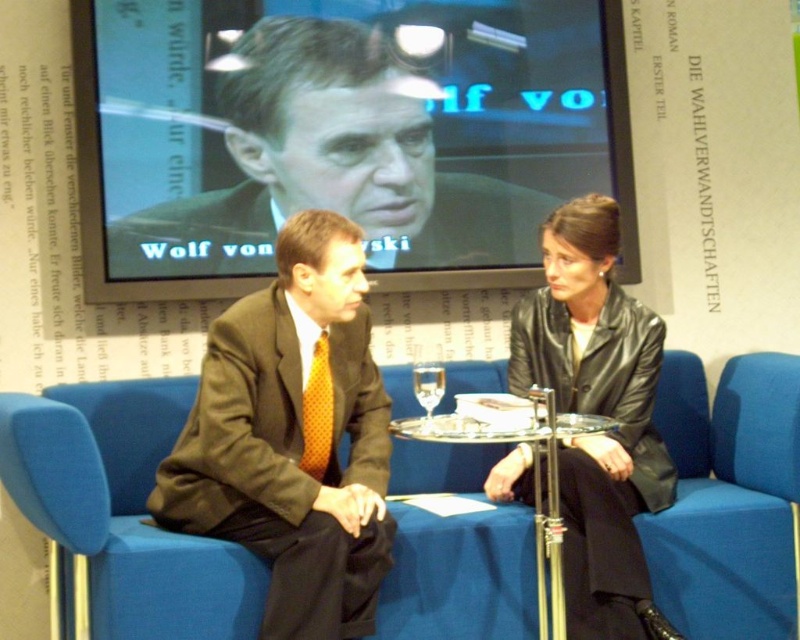
Question: From the image, what is the correct spatial relationship of blue fabric chair at center in relation to clear glass table at center?

Choices:
 (A) left
 (B) right

Answer: (B)

Question: Observing the image, what is the correct spatial positioning of matte black suit at upper center in reference to blue fabric chair at lower right?

Choices:
 (A) left
 (B) right

Answer: (A)

Question: Can you confirm if orange dotted tie at center is positioned below transparent glass at table center?

Choices:
 (A) no
 (B) yes

Answer: (B)

Question: Among these points, which one is farthest from the camera?

Choices:
 (A) (417, 372)
 (B) (482, 444)
 (C) (648, 484)

Answer: (B)

Question: Which point appears closest to the camera in this image?

Choices:
 (A) (437, 396)
 (B) (324, 477)

Answer: (A)

Question: Which of the following is the closest to the observer?

Choices:
 (A) (733, 572)
 (B) (318, 164)

Answer: (A)